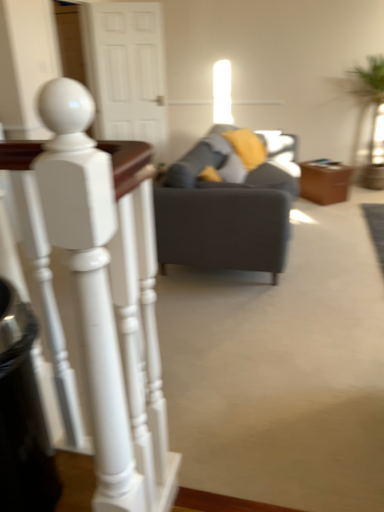
You are a GUI agent. You are given a task and a screenshot of the screen. Output one action in this format:
    pyautogui.click(x=<x>, y=<y>)
    Task: Click on the free space above brown leather side table at center (from a real-world perspective)
    This screenshot has height=512, width=384.
    Given the screenshot: What is the action you would take?
    pyautogui.click(x=327, y=165)